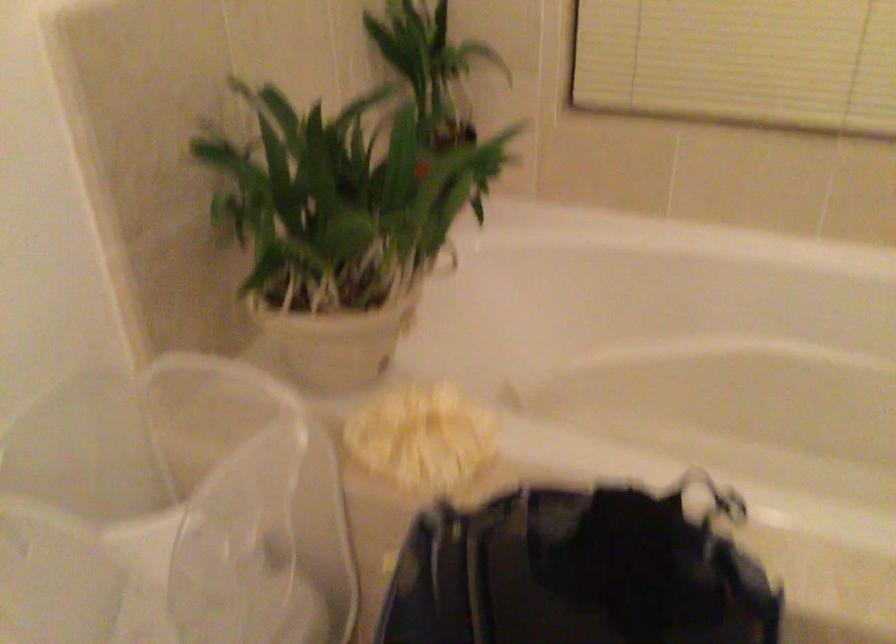
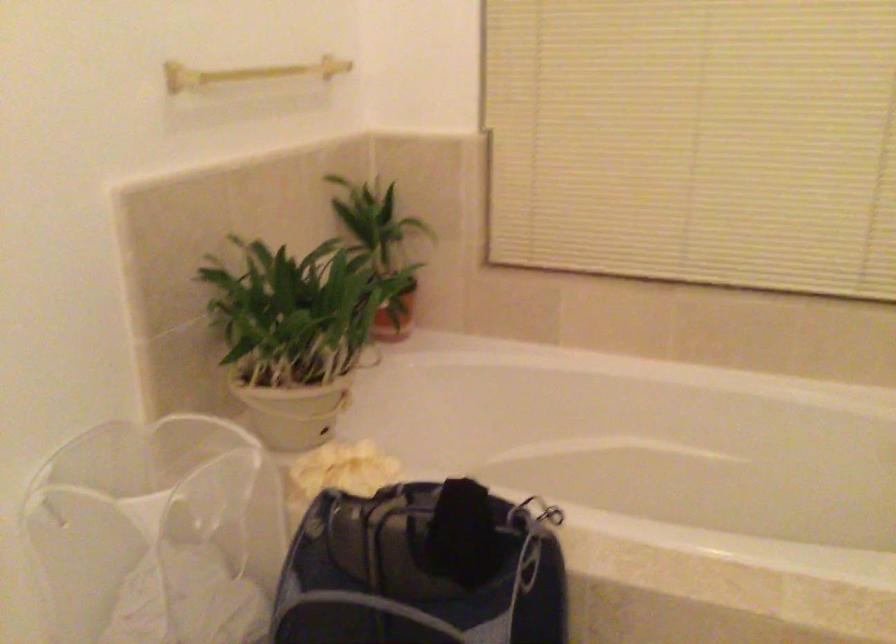
In the second image, find the point that corresponds to (332,345) in the first image.

(289, 410)